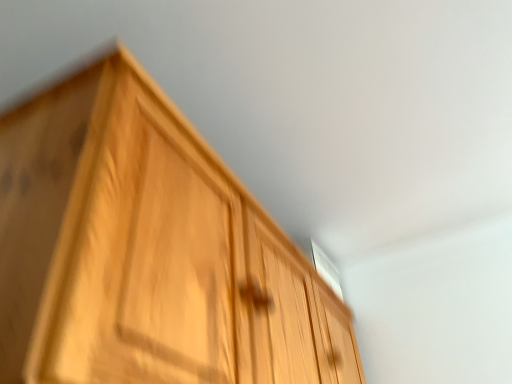
The image size is (512, 384). Find the location of `natural wood cupboard at upper left`. natural wood cupboard at upper left is located at coordinates (147, 251).

The image size is (512, 384). Describe the element at coordinates (147, 251) in the screenshot. I see `natural wood cupboard at upper left` at that location.

You are a GUI agent. You are given a task and a screenshot of the screen. Output one action in this format:
    pyautogui.click(x=<x>, y=<y>)
    Task: Click on the natural wood cupboard at upper left
    
    Given the screenshot: What is the action you would take?
    pyautogui.click(x=147, y=251)